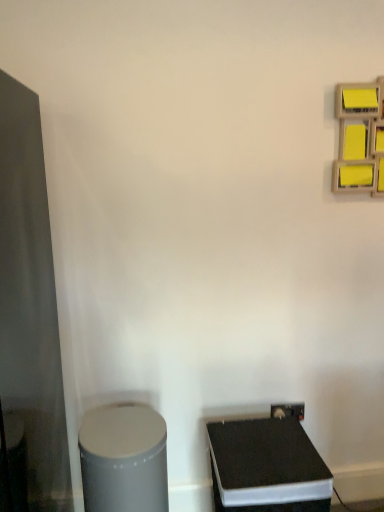
Measure the distance between black matte speaker at lower right, which appears as the first wide when viewed from the right, and camera.

black matte speaker at lower right, which appears as the first wide when viewed from the right, is 1.27 meters away from camera.

What is the approximate width of matte black glass door at left?

matte black glass door at left is 79.03 centimeters in width.

The width and height of the screenshot is (384, 512). What do you see at coordinates (30, 302) in the screenshot?
I see `matte black glass door at left` at bounding box center [30, 302].

Find the location of a particular element. black matte speaker at lower right, which appears as the first wide when viewed from the right is located at coordinates click(267, 467).

From the image's perspective, is black matte speaker at lower right, which appears as the first wide when viewed from the right, above or below matte black glass door at left?

Based on their image positions, black matte speaker at lower right, which appears as the first wide when viewed from the right, is located beneath matte black glass door at left.

Is black matte speaker at lower right, which appears as the first wide when viewed from the right, wider or thinner than matte black glass door at left?

black matte speaker at lower right, which appears as the first wide when viewed from the right, is thinner than matte black glass door at left.

Which is more to the left, black matte speaker at lower right, which appears as the first wide when viewed from the right, or matte black glass door at left?

matte black glass door at left is more to the left.

Does point (307, 465) come in front of point (30, 351)?

Yes, it is in front of point (30, 351).

From a real-world perspective, relative to yellow matte sticky notes at upper right, is black matte speaker at lower right, which appears as the first wide when viewed from the right, vertically above or below?

black matte speaker at lower right, which appears as the first wide when viewed from the right, is below yellow matte sticky notes at upper right.

Is black matte speaker at lower right, which appears as the first wide when viewed from the right, aimed at yellow matte sticky notes at upper right?

No.

Considering the positions of objects black matte speaker at lower right, which is the second wide from left to right, and yellow matte sticky notes at upper right in the image provided, who is more to the left, black matte speaker at lower right, which is the second wide from left to right, or yellow matte sticky notes at upper right?

black matte speaker at lower right, which is the second wide from left to right.

From the picture: Is yellow matte sticky notes at upper right completely or partially inside black matte speaker at lower right, which is the second wide from left to right?

That's incorrect, yellow matte sticky notes at upper right is not inside black matte speaker at lower right, which is the second wide from left to right.

From the image's perspective, is yellow matte sticky notes at upper right located above satin silver trash can at lower left, the first wide in the left-to-right sequence?

Correct, yellow matte sticky notes at upper right appears higher than satin silver trash can at lower left, the first wide in the left-to-right sequence, in the image.

Where is `shelf that is behind the satin silver trash can at lower left, the second wide positioned from the right`? The width and height of the screenshot is (384, 512). shelf that is behind the satin silver trash can at lower left, the second wide positioned from the right is located at coordinates (356, 137).

From a real-world perspective, is yellow matte sticky notes at upper right positioned under satin silver trash can at lower left, the first wide in the left-to-right sequence, based on gravity?

No.

Looking at their sizes, would you say satin silver trash can at lower left, the second wide positioned from the right, is wider or thinner than matte black glass door at left?

In the image, satin silver trash can at lower left, the second wide positioned from the right, appears to be more narrow than matte black glass door at left.

Is point (150, 410) positioned after point (37, 206)?

Yes, it is.

From the image's perspective, is satin silver trash can at lower left, the first wide in the left-to-right sequence, positioned above or below matte black glass door at left?

From the image's perspective, satin silver trash can at lower left, the first wide in the left-to-right sequence, appears below matte black glass door at left.

From a real-world perspective, which object rests below the other?

black matte speaker at lower right, which is the second wide from left to right.

Is matte black glass door at left not near black matte speaker at lower right, which appears as the first wide when viewed from the right?

No, matte black glass door at left is not far away from black matte speaker at lower right, which appears as the first wide when viewed from the right.

Does point (18, 234) lie in front of point (291, 438)?

That is False.

What's the angular difference between yellow matte sticky notes at upper right and matte black glass door at left's facing directions?

0.858 degrees.

Consider the image. Considering the positions of objects yellow matte sticky notes at upper right and matte black glass door at left in the image provided, who is more to the right, yellow matte sticky notes at upper right or matte black glass door at left?

yellow matte sticky notes at upper right.

Is yellow matte sticky notes at upper right far from matte black glass door at left?

That's right, there is a large distance between yellow matte sticky notes at upper right and matte black glass door at left.

From the image's perspective, is yellow matte sticky notes at upper right below matte black glass door at left?

Incorrect, from the image's perspective, yellow matte sticky notes at upper right is higher than matte black glass door at left.

Which of these two, yellow matte sticky notes at upper right or black matte speaker at lower right, which appears as the first wide when viewed from the right, stands taller?

With more height is black matte speaker at lower right, which appears as the first wide when viewed from the right.

Looking at this image, does yellow matte sticky notes at upper right have a larger size compared to black matte speaker at lower right, which appears as the first wide when viewed from the right?

Actually, yellow matte sticky notes at upper right might be smaller than black matte speaker at lower right, which appears as the first wide when viewed from the right.

Looking at this image, how different are the orientations of yellow matte sticky notes at upper right and black matte speaker at lower right, which is the second wide from left to right, in degrees?

They differ by 0.000368 degrees in their facing directions.

Is yellow matte sticky notes at upper right facing away from black matte speaker at lower right, which is the second wide from left to right?

No, yellow matte sticky notes at upper right is not facing the opposite direction of black matte speaker at lower right, which is the second wide from left to right.

Identify the location of glass door on the left of black matte speaker at lower right, which is the second wide from left to right. Image resolution: width=384 pixels, height=512 pixels. (30, 302).

The height and width of the screenshot is (512, 384). Identify the location of shelf above the black matte speaker at lower right, which appears as the first wide when viewed from the right (from the image's perspective). (356, 137).

From the image, which object appears to be farther from satin silver trash can at lower left, the second wide positioned from the right, matte black glass door at left or yellow matte sticky notes at upper right?

The object further to satin silver trash can at lower left, the second wide positioned from the right, is yellow matte sticky notes at upper right.

When comparing their distances from matte black glass door at left, does satin silver trash can at lower left, the first wide in the left-to-right sequence, or yellow matte sticky notes at upper right seem closer?

satin silver trash can at lower left, the first wide in the left-to-right sequence, is positioned closer to the anchor matte black glass door at left.

From the image, which object appears to be nearer to matte black glass door at left, black matte speaker at lower right, which appears as the first wide when viewed from the right, or yellow matte sticky notes at upper right?

black matte speaker at lower right, which appears as the first wide when viewed from the right, is closer to matte black glass door at left.

From the image, which object appears to be farther from black matte speaker at lower right, which appears as the first wide when viewed from the right, matte black glass door at left or yellow matte sticky notes at upper right?

yellow matte sticky notes at upper right is positioned further to the anchor black matte speaker at lower right, which appears as the first wide when viewed from the right.

Looking at this image, from the image, which object appears to be nearer to satin silver trash can at lower left, the first wide in the left-to-right sequence, black matte speaker at lower right, which is the second wide from left to right, or yellow matte sticky notes at upper right?

black matte speaker at lower right, which is the second wide from left to right.

Estimate the real-world distances between objects in this image. Which object is further from matte black glass door at left, yellow matte sticky notes at upper right or satin silver trash can at lower left, the second wide positioned from the right?

yellow matte sticky notes at upper right.

Considering their positions, is matte black glass door at left positioned further to yellow matte sticky notes at upper right than satin silver trash can at lower left, the first wide in the left-to-right sequence?

Based on the image, satin silver trash can at lower left, the first wide in the left-to-right sequence, appears to be further to yellow matte sticky notes at upper right.

Which object lies nearer to the anchor point black matte speaker at lower right, which is the second wide from left to right, satin silver trash can at lower left, the first wide in the left-to-right sequence, or matte black glass door at left?

Based on the image, satin silver trash can at lower left, the first wide in the left-to-right sequence, appears to be nearer to black matte speaker at lower right, which is the second wide from left to right.

At what (x,y) coordinates should I click in order to perform the action: click on wide between yellow matte sticky notes at upper right and black matte speaker at lower right, which appears as the first wide when viewed from the right, vertically. Please return your answer as a coordinate pair (x, y). This screenshot has width=384, height=512. Looking at the image, I should click on (123, 459).

Image resolution: width=384 pixels, height=512 pixels. I want to click on wide between matte black glass door at left and black matte speaker at lower right, which is the second wide from left to right, in the horizontal direction, so coord(123,459).

The image size is (384, 512). Find the location of `glass door between yellow matte sticky notes at upper right and black matte speaker at lower right, which is the second wide from left to right, from top to bottom`. glass door between yellow matte sticky notes at upper right and black matte speaker at lower right, which is the second wide from left to right, from top to bottom is located at coordinates (30, 302).

I want to click on glass door between yellow matte sticky notes at upper right and satin silver trash can at lower left, the first wide in the left-to-right sequence, vertically, so click(30, 302).